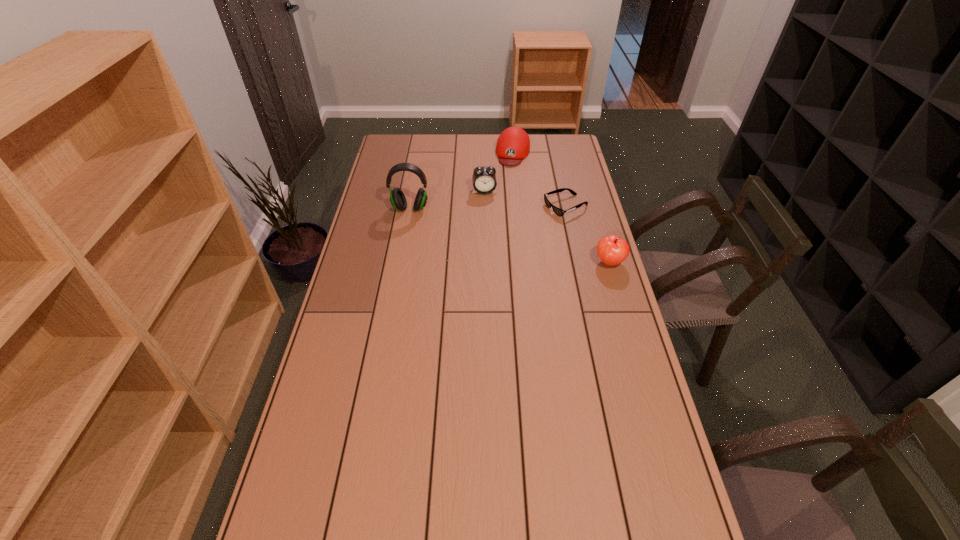
Image resolution: width=960 pixels, height=540 pixels. I want to click on free space on the desktop that is between the tallest object and the nearest object and is positioned on the front-facing side of the sunglasses, so click(500, 233).

I want to click on free space on the desktop that is between the headset and the nearest object and is positioned on the front-facing side of the third object from left to right, so click(x=493, y=231).

Where is `vacant space on the desktop that is between the headset and the nearest object and is positioned on the front side of the second object from left to right`? vacant space on the desktop that is between the headset and the nearest object and is positioned on the front side of the second object from left to right is located at coordinates tap(492, 230).